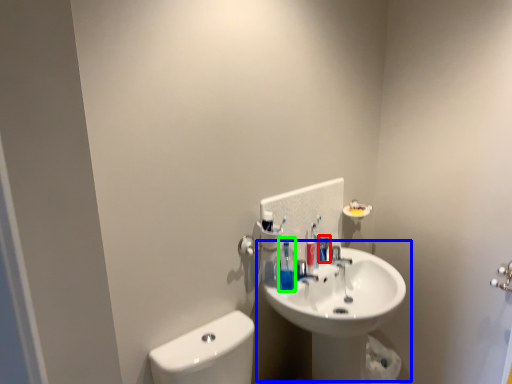
Question: Which is farther away from mouthwash (highlighted by a red box)? sink (highlighted by a blue box) or toiletry (highlighted by a green box)?

Choices:
 (A) sink
 (B) toiletry

Answer: (A)